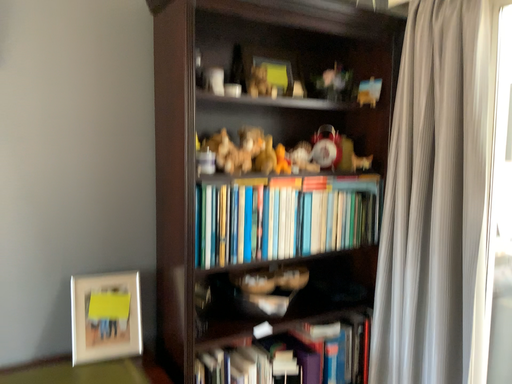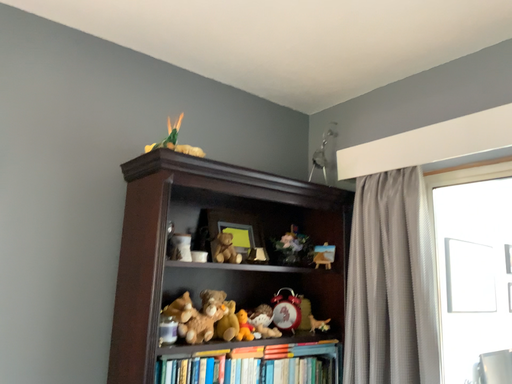
Question: How did the camera likely rotate when shooting the video?

Choices:
 (A) rotated left
 (B) rotated right

Answer: (B)